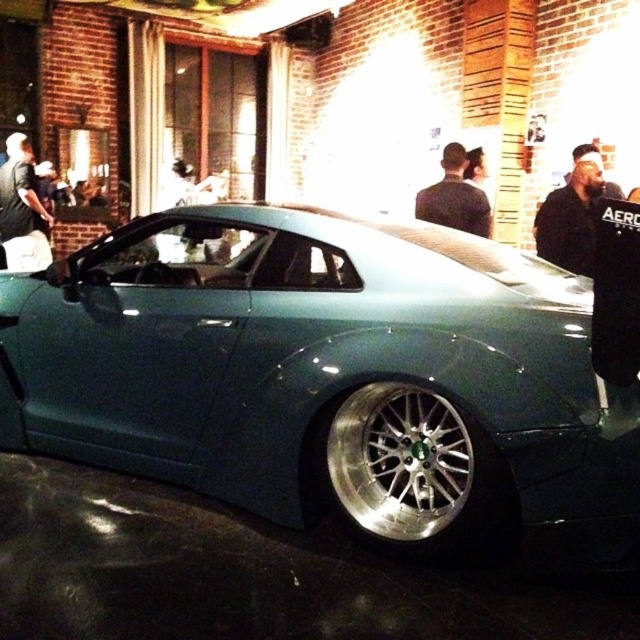
You are a photographer trying to capture the teal metallic car at center and the dark gray fabric jacket at upper center in the same frame. Can you position yourself so that both objects are visible without one blocking the other?

The teal metallic car at center is in front of the dark gray fabric jacket at upper center, so positioning yourself to avoid the car blocking the jacket might be challenging. However, by moving to the side or adjusting your angle, you might find a vantage point where both are visible without obstruction.

You are standing at the point marked as point (400, 460) in the image. Looking around, you see the silver polished rim at lower center. What object is directly in front of you?

The point (400, 460) corresponds to the silver polished rim at lower center, so the object directly in front of you is the silver polished rim at lower center.

You are a photographer trying to capture both the silver polished rim at lower center and the dark gray fabric jacket at upper center in a single frame. Based on their sizes in the image, which object should you focus on first to ensure both are in focus?

Since the silver polished rim at lower center is smaller than the dark gray fabric jacket at upper center, you should focus on the dark gray fabric jacket at upper center first as it is larger and will be easier to frame properly.